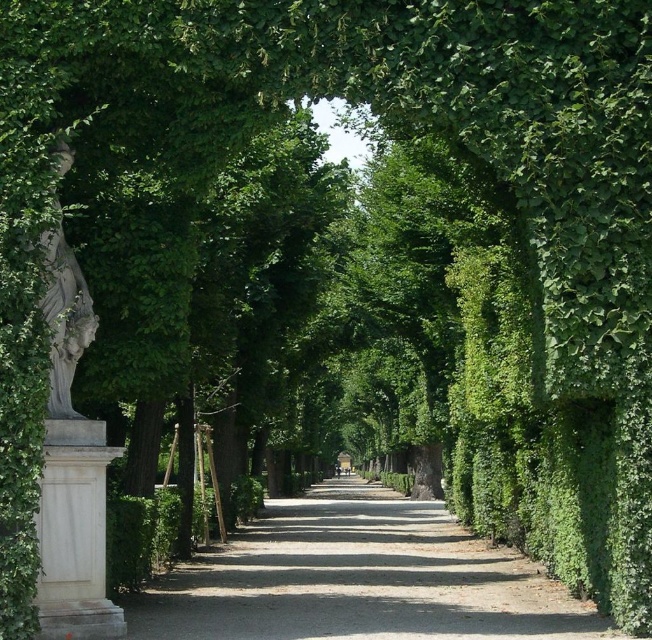
Question: Among these objects, which one is farthest from the camera?

Choices:
 (A) white marble pillar at left
 (B) white stone statue at left

Answer: (A)

Question: Which object is closer to the camera taking this photo?

Choices:
 (A) white stone statue at left
 (B) white marble pillar at left

Answer: (A)

Question: Can you confirm if white marble pillar at left is smaller than white stone statue at left?

Choices:
 (A) yes
 (B) no

Answer: (A)

Question: Does white marble pillar at left appear under white stone statue at left?

Choices:
 (A) yes
 (B) no

Answer: (A)

Question: Is white marble pillar at left below white stone statue at left?

Choices:
 (A) yes
 (B) no

Answer: (A)